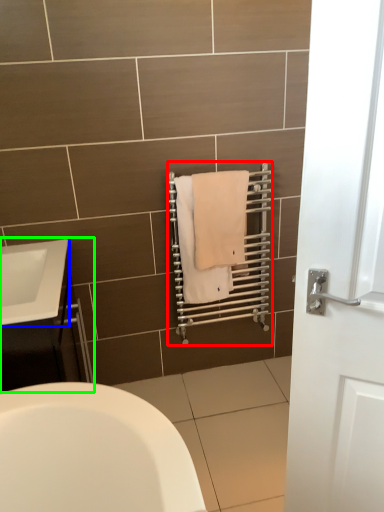
Question: Which object is the farthest from balustrade (highlighted by a red box)? Choose among these: sink (highlighted by a blue box) or bathroom cabinet (highlighted by a green box).

Choices:
 (A) sink
 (B) bathroom cabinet

Answer: (A)